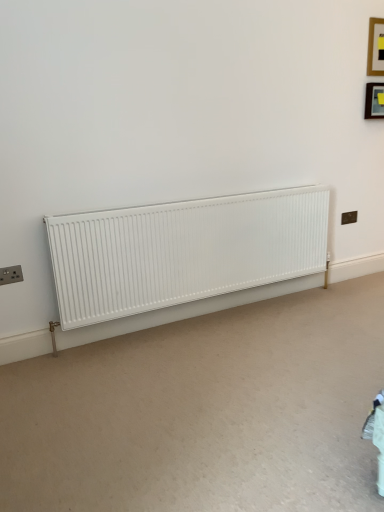
Find the location of a particular element. The width and height of the screenshot is (384, 512). matte black socket at lower left, which is the second electric outlet in right-to-left order is located at coordinates (11, 275).

Describe the element at coordinates (375, 47) in the screenshot. I see `wooden frame at upper right, placed as the second picture frame when sorted from bottom to top` at that location.

This screenshot has width=384, height=512. Describe the element at coordinates (349, 217) in the screenshot. I see `black plastic electric outlet at upper right, which is counted as the first electric outlet, starting from the right` at that location.

I want to click on matte black socket at lower left, the first electric outlet from the left, so click(x=11, y=275).

Which is behind, point (376, 111) or point (260, 255)?

The point (376, 111) is farther.

Measure the distance between matte black picture frame at upper right, which is the 1th picture frame in bottom-to-top order, and white matte radiator at center.

The distance of matte black picture frame at upper right, which is the 1th picture frame in bottom-to-top order, from white matte radiator at center is 4.73 feet.

Is matte black picture frame at upper right, which is counted as the 2th picture frame, starting from the top, not near white matte radiator at center?

Yes, matte black picture frame at upper right, which is counted as the 2th picture frame, starting from the top, and white matte radiator at center are located far from each other.

Which is more to the left, matte black picture frame at upper right, which is the 1th picture frame in bottom-to-top order, or white matte radiator at center?

white matte radiator at center is more to the left.

Which of these two, black plastic electric outlet at upper right, marked as the 1th electric outlet in a back-to-front arrangement, or white matte radiator at center, is bigger?

With larger size is white matte radiator at center.

Is white matte radiator at center inside black plastic electric outlet at upper right, the 2th electric outlet in the front-to-back sequence?

Actually, white matte radiator at center is outside black plastic electric outlet at upper right, the 2th electric outlet in the front-to-back sequence.

From a real-world perspective, is black plastic electric outlet at upper right, marked as the 1th electric outlet in a back-to-front arrangement, located beneath white matte radiator at center?

No, from a real-world perspective, black plastic electric outlet at upper right, marked as the 1th electric outlet in a back-to-front arrangement, is not below white matte radiator at center.

Does black plastic electric outlet at upper right, marked as the 1th electric outlet in a back-to-front arrangement, have a greater height compared to matte black socket at lower left, arranged as the 1th electric outlet when ordered from the bottom?

Incorrect, the height of black plastic electric outlet at upper right, marked as the 1th electric outlet in a back-to-front arrangement, is not larger of that of matte black socket at lower left, arranged as the 1th electric outlet when ordered from the bottom.

Looking at their sizes, would you say black plastic electric outlet at upper right, which is counted as the first electric outlet, starting from the right, is wider or thinner than matte black socket at lower left, arranged as the 1th electric outlet when ordered from the bottom?

In the image, black plastic electric outlet at upper right, which is counted as the first electric outlet, starting from the right, appears to be more narrow than matte black socket at lower left, arranged as the 1th electric outlet when ordered from the bottom.

Is black plastic electric outlet at upper right, which is counted as the first electric outlet, starting from the right, beside matte black socket at lower left, arranged as the 1th electric outlet when ordered from the bottom?

No, black plastic electric outlet at upper right, which is counted as the first electric outlet, starting from the right, is not in contact with matte black socket at lower left, arranged as the 1th electric outlet when ordered from the bottom.

Relative to black plastic electric outlet at upper right, the 2th electric outlet from the bottom, is white matte radiator at center in front or behind?

white matte radiator at center is positioned closer to the viewer than black plastic electric outlet at upper right, the 2th electric outlet from the bottom.

From a real-world perspective, is white matte radiator at center physically above black plastic electric outlet at upper right, the 2th electric outlet from the bottom?

Actually, white matte radiator at center is physically below black plastic electric outlet at upper right, the 2th electric outlet from the bottom, in the real world.

Considering the sizes of white matte radiator at center and black plastic electric outlet at upper right, which is counted as the first electric outlet, starting from the right, in the image, is white matte radiator at center taller or shorter than black plastic electric outlet at upper right, which is counted as the first electric outlet, starting from the right,?

white matte radiator at center is taller than black plastic electric outlet at upper right, which is counted as the first electric outlet, starting from the right.

Considering the positions of point (65, 222) and point (353, 221), is point (65, 222) closer or farther from the camera than point (353, 221)?

Point (65, 222) appears to be closer to the viewer than point (353, 221).

From the image's perspective, is wooden frame at upper right, acting as the first picture frame starting from the top, on white matte radiator at center?

Indeed, from the image's perspective, wooden frame at upper right, acting as the first picture frame starting from the top, is shown above white matte radiator at center.

Which is behind, wooden frame at upper right, acting as the first picture frame starting from the top, or white matte radiator at center?

Positioned behind is wooden frame at upper right, acting as the first picture frame starting from the top.

Is wooden frame at upper right, acting as the first picture frame starting from the top, looking in the opposite direction of white matte radiator at center?

No.

This screenshot has height=512, width=384. Find the location of `radiator lying below the wooden frame at upper right, acting as the first picture frame starting from the top (from the image's perspective)`. radiator lying below the wooden frame at upper right, acting as the first picture frame starting from the top (from the image's perspective) is located at coordinates (183, 251).

At what (x,y) coordinates should I click in order to perform the action: click on the 2nd picture frame in front of the black plastic electric outlet at upper right, which is counted as the first electric outlet, starting from the right, starting your count from the anchor. Please return your answer as a coordinate pair (x, y). This screenshot has width=384, height=512. Looking at the image, I should click on (375, 47).

Is black plastic electric outlet at upper right, marked as the 1th electric outlet in a back-to-front arrangement, to the right of wooden frame at upper right, placed as the second picture frame when sorted from bottom to top, from the viewer's perspective?

No, black plastic electric outlet at upper right, marked as the 1th electric outlet in a back-to-front arrangement, is not to the right of wooden frame at upper right, placed as the second picture frame when sorted from bottom to top.

From a real-world perspective, is black plastic electric outlet at upper right, the 2th electric outlet in the front-to-back sequence, positioned above or below wooden frame at upper right, placed as the second picture frame when sorted from bottom to top?

black plastic electric outlet at upper right, the 2th electric outlet in the front-to-back sequence, is situated lower than wooden frame at upper right, placed as the second picture frame when sorted from bottom to top, in the real world.

Looking at this image, which object is more forward, black plastic electric outlet at upper right, the 2th electric outlet in the front-to-back sequence, or wooden frame at upper right, placed as the second picture frame when sorted from bottom to top?

wooden frame at upper right, placed as the second picture frame when sorted from bottom to top, is more forward.

Which object is closer to the camera, white matte radiator at center or matte black picture frame at upper right, which is counted as the 2th picture frame, starting from the top?

white matte radiator at center is closer to the camera.

Does point (84, 314) come behind point (378, 102)?

No, (84, 314) is in front of (378, 102).

From a real-world perspective, between white matte radiator at center and matte black picture frame at upper right, which is the 1th picture frame in bottom-to-top order, who is vertically lower?

From a 3D spatial view, white matte radiator at center is below.

Could matte black picture frame at upper right, which is the 1th picture frame in bottom-to-top order, be considered to be inside white matte radiator at center?

No, matte black picture frame at upper right, which is the 1th picture frame in bottom-to-top order, is not surrounded by white matte radiator at center.

This screenshot has height=512, width=384. What are the coordinates of `radiator below the matte black picture frame at upper right, which is counted as the 2th picture frame, starting from the top (from a real-world perspective)` in the screenshot? It's located at pyautogui.click(x=183, y=251).

Starting from the white matte radiator at center, which electric outlet is the 2nd one behind? Please provide its 2D coordinates.

[(349, 217)]

Based on their spatial positions, is matte black socket at lower left, arranged as the 1th electric outlet when ordered from the bottom, or black plastic electric outlet at upper right, the 2th electric outlet in the front-to-back sequence, closer to matte black picture frame at upper right, which is the 1th picture frame in bottom-to-top order?

black plastic electric outlet at upper right, the 2th electric outlet in the front-to-back sequence, is positioned closer to the anchor matte black picture frame at upper right, which is the 1th picture frame in bottom-to-top order.

Estimate the real-world distances between objects in this image. Which object is closer to matte black socket at lower left, the first electric outlet from the left, matte black picture frame at upper right, which is the 1th picture frame in bottom-to-top order, or black plastic electric outlet at upper right, the 2th electric outlet from the bottom?

The object closer to matte black socket at lower left, the first electric outlet from the left, is black plastic electric outlet at upper right, the 2th electric outlet from the bottom.

From the image, which object appears to be farther from matte black socket at lower left, which is counted as the 2th electric outlet, starting from the back, black plastic electric outlet at upper right, the 2th electric outlet from the bottom, or wooden frame at upper right, acting as the first picture frame starting from the top?

wooden frame at upper right, acting as the first picture frame starting from the top, is further to matte black socket at lower left, which is counted as the 2th electric outlet, starting from the back.

Based on the photo, looking at the image, which one is located closer to white matte radiator at center, black plastic electric outlet at upper right, the 2th electric outlet in the front-to-back sequence, or matte black socket at lower left, which is the first electric outlet from front to back?

matte black socket at lower left, which is the first electric outlet from front to back, is closer to white matte radiator at center.

Looking at this image, from the image, which object appears to be nearer to matte black socket at lower left, the first electric outlet from the left, matte black picture frame at upper right, which is counted as the 2th picture frame, starting from the top, or white matte radiator at center?

Among the two, white matte radiator at center is located nearer to matte black socket at lower left, the first electric outlet from the left.

Considering their positions, is matte black socket at lower left, which is the first electric outlet from front to back, positioned further to wooden frame at upper right, acting as the first picture frame starting from the top, than black plastic electric outlet at upper right, the 2th electric outlet in the front-to-back sequence?

matte black socket at lower left, which is the first electric outlet from front to back, is positioned further to the anchor wooden frame at upper right, acting as the first picture frame starting from the top.

Based on their spatial positions, is black plastic electric outlet at upper right, the 2th electric outlet from the bottom, or white matte radiator at center further from matte black socket at lower left, arranged as the 1th electric outlet when ordered from the bottom?

black plastic electric outlet at upper right, the 2th electric outlet from the bottom.

When comparing their distances from black plastic electric outlet at upper right, marked as the 1th electric outlet in a back-to-front arrangement, does matte black socket at lower left, the first electric outlet from the left, or wooden frame at upper right, placed as the second picture frame when sorted from bottom to top, seem further?

Among the two, matte black socket at lower left, the first electric outlet from the left, is located further to black plastic electric outlet at upper right, marked as the 1th electric outlet in a back-to-front arrangement.

Identify the location of picture frame between wooden frame at upper right, acting as the first picture frame starting from the top, and white matte radiator at center, in the vertical direction. This screenshot has height=512, width=384. (374, 101).

Find the location of a particular element. The image size is (384, 512). electric outlet situated between white matte radiator at center and matte black picture frame at upper right, which is the 1th picture frame in bottom-to-top order, from left to right is located at coordinates (349, 217).

I want to click on radiator between matte black socket at lower left, arranged as the 1th electric outlet when ordered from the bottom, and wooden frame at upper right, placed as the second picture frame when sorted from bottom to top, in the horizontal direction, so click(183, 251).

At what (x,y) coordinates should I click in order to perform the action: click on picture frame between wooden frame at upper right, placed as the second picture frame when sorted from bottom to top, and black plastic electric outlet at upper right, which is counted as the first electric outlet, starting from the right, vertically. Please return your answer as a coordinate pair (x, y). Looking at the image, I should click on (374, 101).